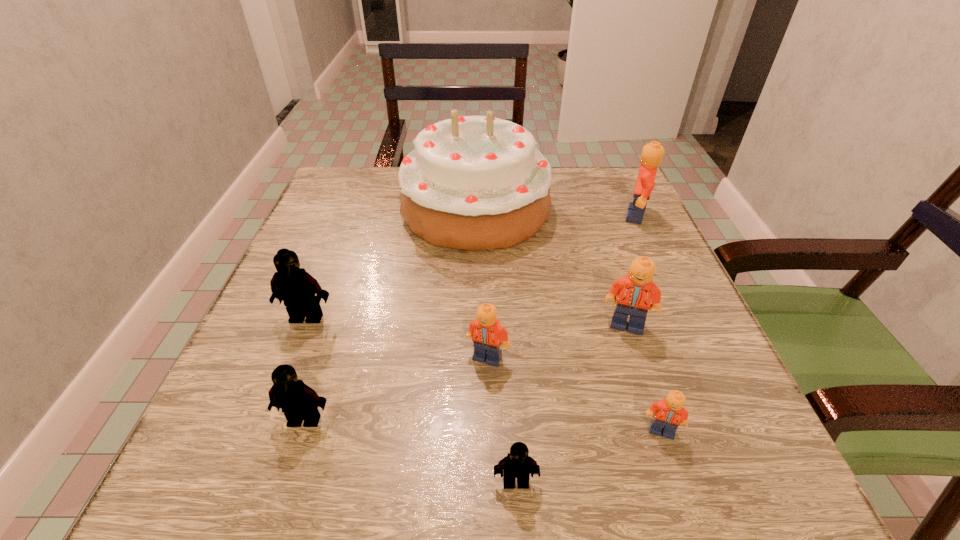
Locate an element on the screen. Image resolution: width=960 pixels, height=540 pixels. the rightmost black Lego is located at coordinates (518, 464).

Identify the location of the smallest black Lego. This screenshot has width=960, height=540. (518, 464).

The width and height of the screenshot is (960, 540). Identify the location of free spot located on the left of the cake. (364, 208).

In order to click on vacant space situated 0.210m on the front-facing side of the rightmost Lego in this screenshot , I will do `click(533, 216)`.

Find the location of a particular element. free location located 0.230m on the front-facing side of the rightmost Lego is located at coordinates (524, 216).

The image size is (960, 540). Identify the location of vacant space situated on the front-facing side of the rightmost Lego. (498, 216).

This screenshot has height=540, width=960. In order to click on free space located on the front-facing side of the third smallest orange Lego in this screenshot , I will do `click(664, 440)`.

Identify the location of blank space located 0.160m on the face of the biggest black Lego. The image size is (960, 540). (272, 405).

Find the location of `vacant area situated on the front-facing side of the fifth farthest object`. vacant area situated on the front-facing side of the fifth farthest object is located at coordinates (490, 488).

What are the coordinates of `vacant space situated 0.070m on the face of the second nearest black Lego` in the screenshot? It's located at (285, 478).